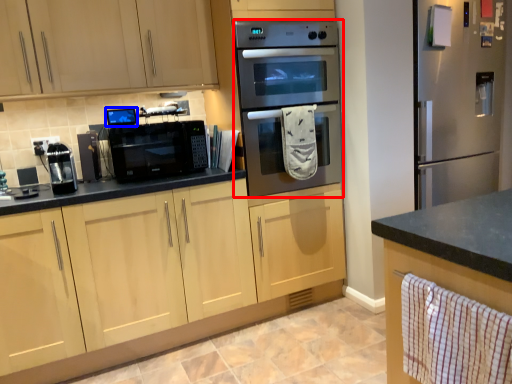
Question: Among these objects, which one is nearest to the camera, microwave oven (highlighted by a red box) or appliance (highlighted by a blue box)?

Choices:
 (A) microwave oven
 (B) appliance

Answer: (A)